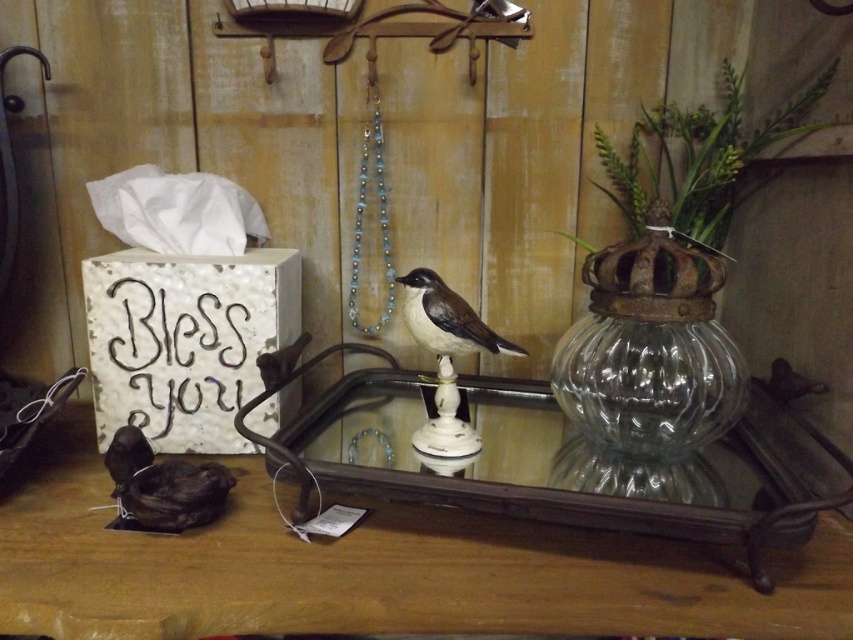
Does brown wooden table at lower center have a lesser width compared to matte black bird at lower left?

In fact, brown wooden table at lower center might be wider than matte black bird at lower left.

Is brown wooden table at lower center taller than matte black bird at lower left?

Correct, brown wooden table at lower center is much taller as matte black bird at lower left.

The width and height of the screenshot is (853, 640). What do you see at coordinates (376, 568) in the screenshot?
I see `brown wooden table at lower center` at bounding box center [376, 568].

Where is `brown wooden table at lower center`? The width and height of the screenshot is (853, 640). brown wooden table at lower center is located at coordinates (376, 568).

Can you confirm if matte black bird at lower left is positioned to the right of brown speckled feathers at center?

In fact, matte black bird at lower left is to the left of brown speckled feathers at center.

Looking at this image, between matte black bird at lower left and brown speckled feathers at center, which one has less height?

With less height is brown speckled feathers at center.

Measure the distance between matte black bird at lower left and camera.

matte black bird at lower left is 83.52 centimeters from camera.

Find the location of `matte black bird at lower left`. matte black bird at lower left is located at coordinates (163, 484).

Is point (772, 564) positioned behind point (663, 396)?

No.

Measure the distance between brown wooden table at lower center and clear glass vase at center.

brown wooden table at lower center is 9.66 inches from clear glass vase at center.

Is point (300, 582) less distant than point (602, 257)?

Yes, point (300, 582) is in front of point (602, 257).

Locate an element on the screen. brown wooden table at lower center is located at coordinates (376, 568).